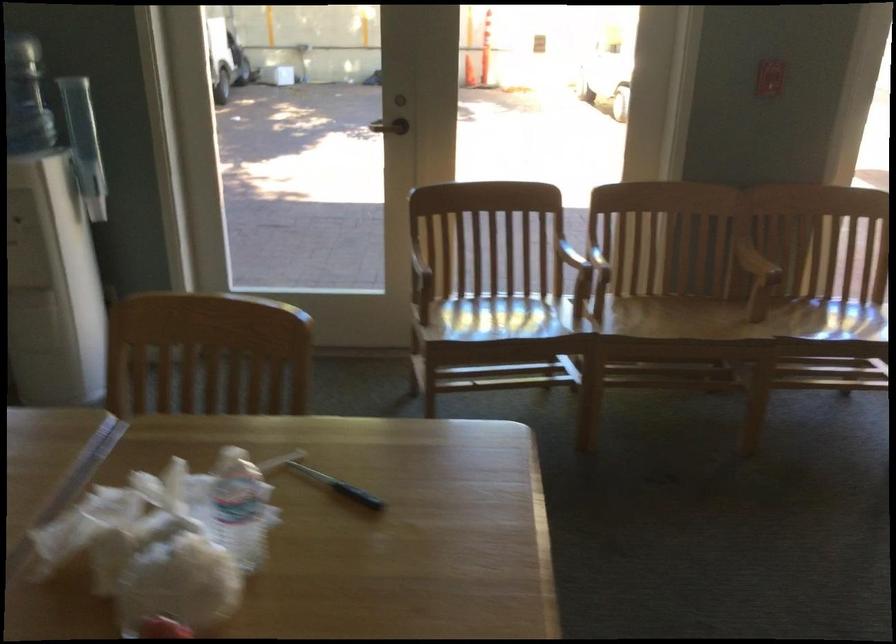
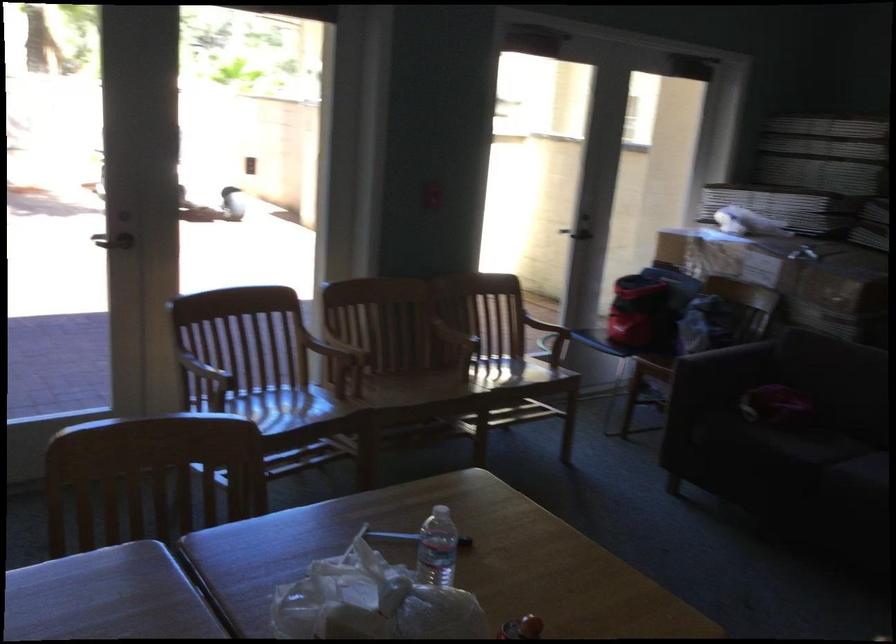
In the second image, find the point that corresponds to point 398,116 in the first image.

(113, 241)